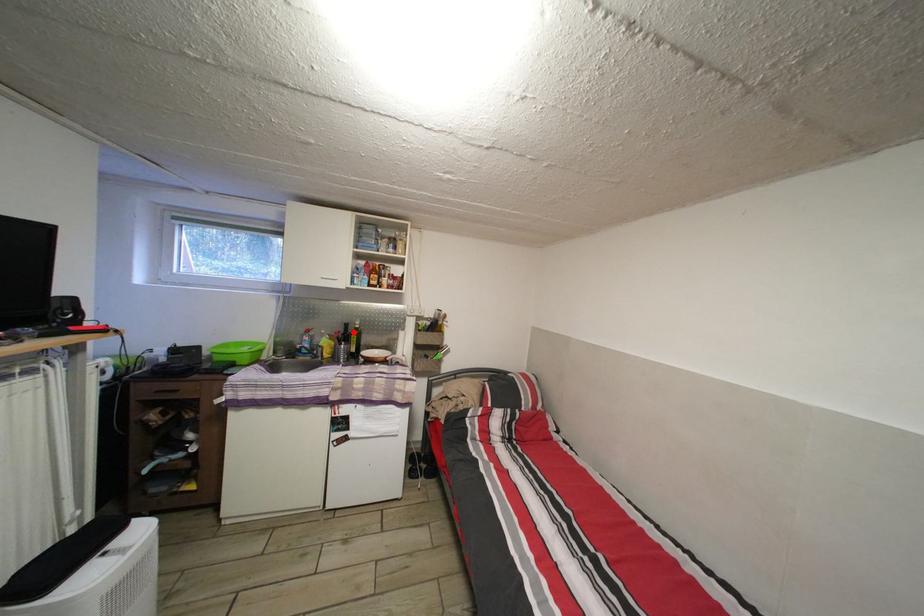
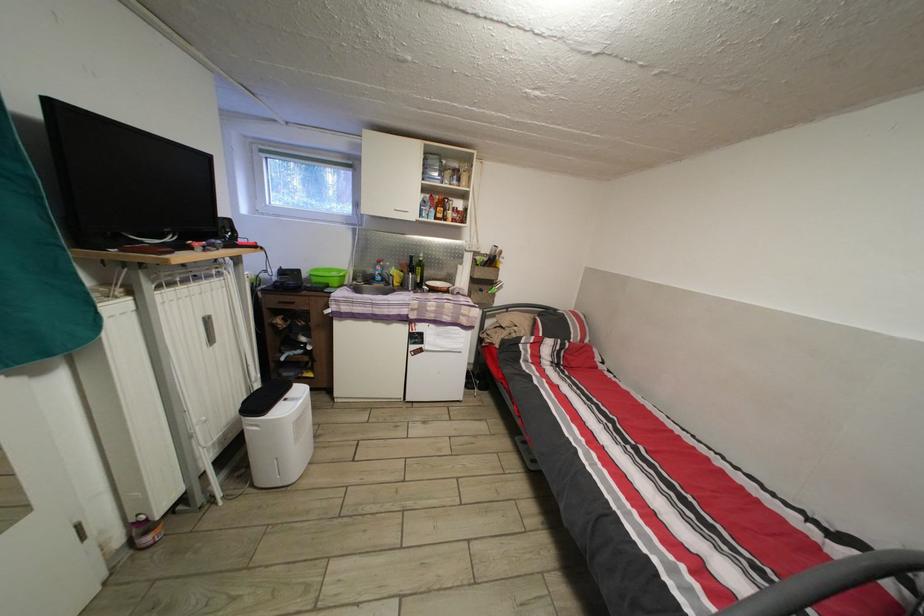
Locate, in the second image, the point that corresponds to the highlighted location in the first image.

(419, 265)